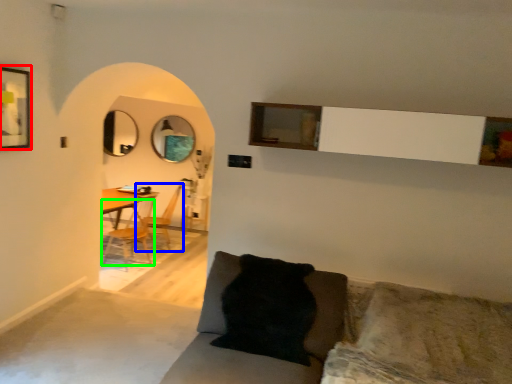
Question: Which object is the closest to the picture frame (highlighted by a red box)? Choose among these: armchair (highlighted by a blue box) or chair (highlighted by a green box).

Choices:
 (A) armchair
 (B) chair

Answer: (B)